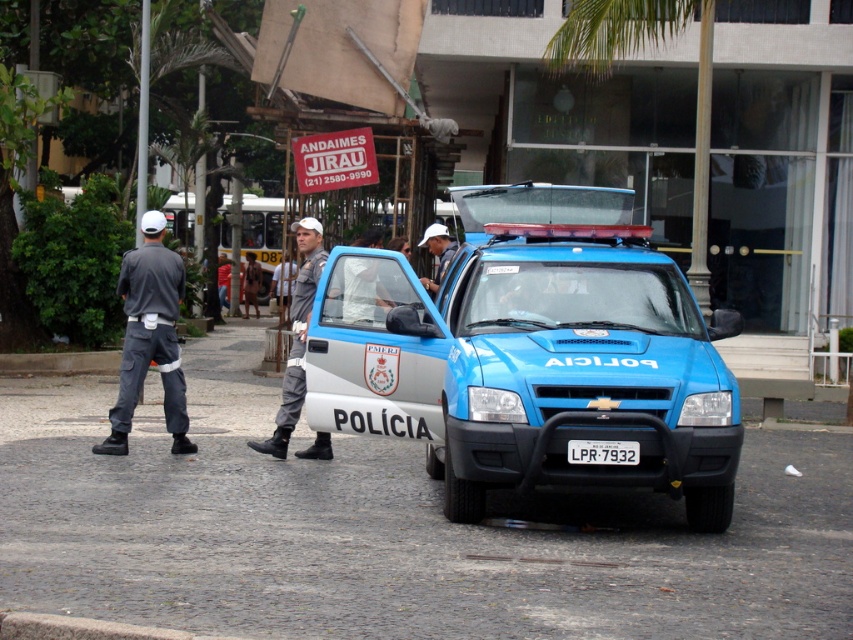
Question: Which point appears closest to the camera in this image?

Choices:
 (A) (146, 364)
 (B) (287, 424)

Answer: (B)

Question: Is gray uniform pants at center to the right of white matte cap at center from the viewer's perspective?

Choices:
 (A) no
 (B) yes

Answer: (A)

Question: Is gray uniform pants at center below white matte cap at center?

Choices:
 (A) yes
 (B) no

Answer: (A)

Question: Can you confirm if dark gray uniform at left is positioned to the right of gray uniform pants at center?

Choices:
 (A) yes
 (B) no

Answer: (B)

Question: Which object appears farthest from the camera in this image?

Choices:
 (A) dark gray uniform at left
 (B) white plastic license plate at center
 (C) gray uniform pants at center

Answer: (A)

Question: Which object is positioned closest to the white matte cap at center?

Choices:
 (A) gray uniform pants at center
 (B) dark gray uniform at left

Answer: (A)